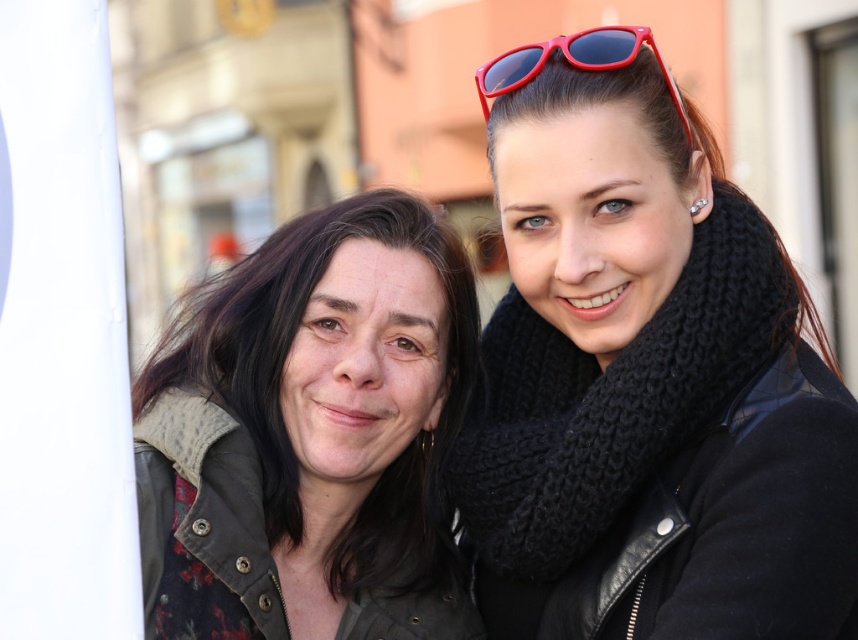
Does dark brown leather jacket at center have a lesser width compared to black knitted scarf at upper right?

No, dark brown leather jacket at center is not thinner than black knitted scarf at upper right.

Is dark brown leather jacket at center to the right of black knitted scarf at upper right from the viewer's perspective?

No, dark brown leather jacket at center is not to the right of black knitted scarf at upper right.

Image resolution: width=858 pixels, height=640 pixels. I want to click on dark brown leather jacket at center, so click(x=310, y=435).

Which is below, black knitted scarf at upper right or shiny plastic sunglasses at upper right?

Positioned lower is black knitted scarf at upper right.

Is point (780, 301) farther from camera compared to point (491, 61)?

No, (780, 301) is closer to viewer.

Between point (636, 419) and point (587, 54), which one is positioned behind?

Point (587, 54)

The width and height of the screenshot is (858, 640). I want to click on black knitted scarf at upper right, so click(609, 397).

Who is shorter, dark brown leather jacket at center or shiny plastic sunglasses at upper right?

Standing shorter between the two is shiny plastic sunglasses at upper right.

Which is behind, point (150, 426) or point (627, 33)?

The point (150, 426) is behind.

This screenshot has width=858, height=640. Find the location of `dark brown leather jacket at center`. dark brown leather jacket at center is located at coordinates (310, 435).